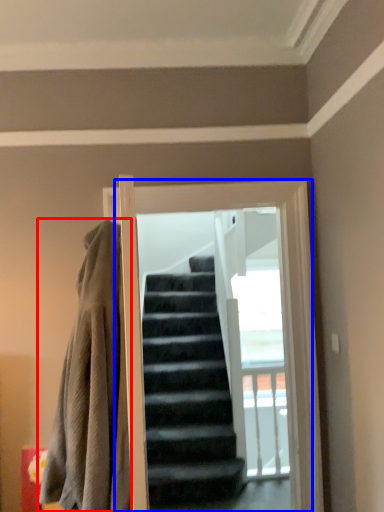
Question: Among these objects, which one is nearest to the camera, blanket (highlighted by a red box) or screen door (highlighted by a blue box)?

Choices:
 (A) blanket
 (B) screen door

Answer: (A)